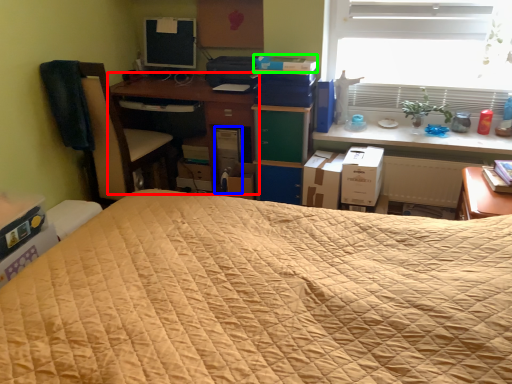
Question: Which object is the farthest from desk (highlighted by a red box)? Choose among these: computer tower (highlighted by a blue box) or paperback book (highlighted by a green box).

Choices:
 (A) computer tower
 (B) paperback book

Answer: (B)